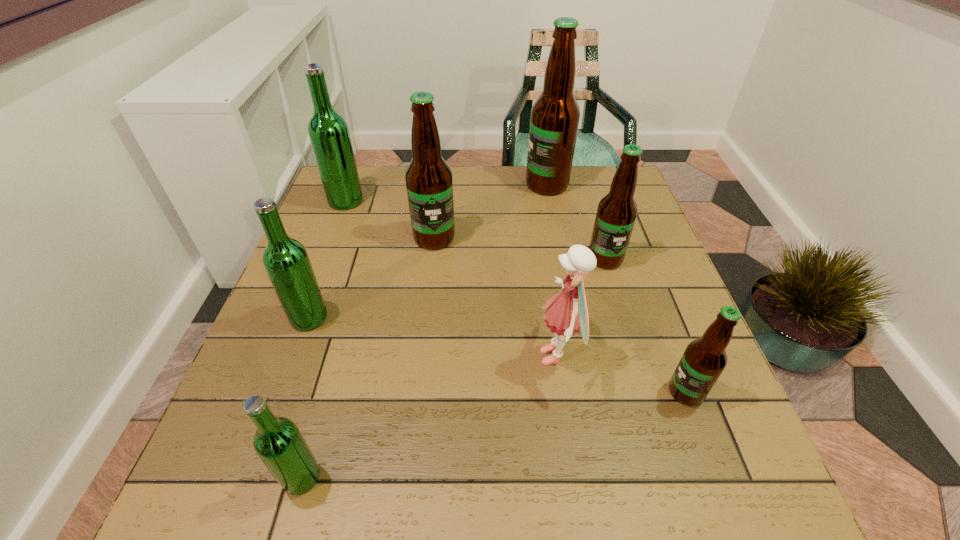
In order to click on the farthest brown beer bottle in this screenshot , I will do `click(554, 121)`.

The height and width of the screenshot is (540, 960). In order to click on the biggest brown beer bottle in this screenshot , I will do click(554, 121).

Locate an element on the screen. The height and width of the screenshot is (540, 960). the farthest green beer bottle is located at coordinates (328, 131).

At what (x,y) coordinates should I click in order to perform the action: click on the leftmost brown beer bottle. Please return your answer as a coordinate pair (x, y). The image size is (960, 540). Looking at the image, I should click on (429, 184).

I want to click on the fourth object from left to right, so 429,184.

Identify the location of the third biggest brown beer bottle. This screenshot has height=540, width=960. (617, 211).

The height and width of the screenshot is (540, 960). What are the coordinates of `the second nearest green beer bottle` in the screenshot? It's located at (286, 261).

This screenshot has width=960, height=540. Identify the location of the second biggest green beer bottle. (286, 261).

Where is `doll`? Image resolution: width=960 pixels, height=540 pixels. doll is located at coordinates (567, 313).

I want to click on the nearest brown beer bottle, so click(703, 361).